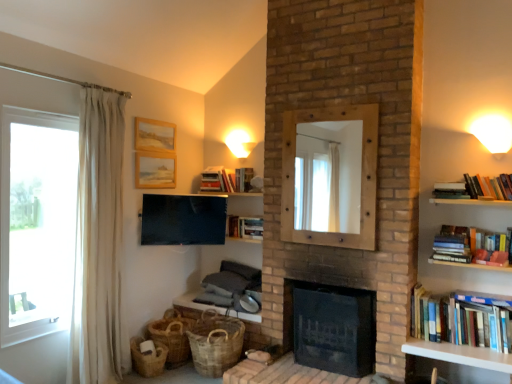
The width and height of the screenshot is (512, 384). What are the coordinates of `wooden mirror at center, arranged as the first fireplace when viewed from the top` in the screenshot? It's located at (361, 177).

In order to click on hardcover books at right, placed as the fourth book when sorted from bottom to top in this screenshot , I will do `click(489, 187)`.

What is the approximate height of matte white sconce at upper center, which ranks as the 2th light fixture in front-to-back order?

9.42 inches.

This screenshot has height=384, width=512. What do you see at coordinates (215, 343) in the screenshot?
I see `brown woven basket at lower left, placed as the 3th basket when sorted from left to right` at bounding box center [215, 343].

At what (x,y) coordinates should I click in order to perform the action: click on wooden mirror at center, the 2th fireplace from the bottom. Please return your answer as a coordinate pair (x, y). Looking at the image, I should click on (361, 177).

Based on the photo, based on their positions, is wooden textured table at lower center, marked as the 1th table in a left-to-right arrangement, located to the left or right of white matte wall sconce at upper right, which ranks as the 1th light fixture in right-to-left order?

wooden textured table at lower center, marked as the 1th table in a left-to-right arrangement, is to the left of white matte wall sconce at upper right, which ranks as the 1th light fixture in right-to-left order.

From the image's perspective, is wooden textured table at lower center, the first table in the back-to-front sequence, on white matte wall sconce at upper right, which ranks as the 1th light fixture in right-to-left order?

No, from the image's perspective, wooden textured table at lower center, the first table in the back-to-front sequence, is not above white matte wall sconce at upper right, which ranks as the 1th light fixture in right-to-left order.

Considering the sizes of wooden textured table at lower center, marked as the 1th table in a left-to-right arrangement, and white matte wall sconce at upper right, which is counted as the 1th light fixture, starting from the front, in the image, is wooden textured table at lower center, marked as the 1th table in a left-to-right arrangement, bigger or smaller than white matte wall sconce at upper right, which is counted as the 1th light fixture, starting from the front,?

Clearly, wooden textured table at lower center, marked as the 1th table in a left-to-right arrangement, is larger in size than white matte wall sconce at upper right, which is counted as the 1th light fixture, starting from the front.

Consider the image. How much distance is there between wooden textured table at lower center, placed as the 2th table when sorted from front to back, and white matte wall sconce at upper right, which is the second light fixture in back-to-front order?

The distance of wooden textured table at lower center, placed as the 2th table when sorted from front to back, from white matte wall sconce at upper right, which is the second light fixture in back-to-front order, is 2.47 meters.

From the image's perspective, between woven brown basket at lower left, which appears as the 2th basket when viewed from the right, and flat screen tv at upper center, who is located below?

woven brown basket at lower left, which appears as the 2th basket when viewed from the right, is shown below in the image.

Consider the image. Can you tell me how much woven brown basket at lower left, which appears as the 2th basket when viewed from the right, and flat screen tv at upper center differ in facing direction?

woven brown basket at lower left, which appears as the 2th basket when viewed from the right, and flat screen tv at upper center are facing 41.9 degrees away from each other.

Is woven brown basket at lower left, which appears as the 2th basket when viewed from the right, not near flat screen tv at upper center?

Actually, woven brown basket at lower left, which appears as the 2th basket when viewed from the right, and flat screen tv at upper center are a little close together.

From a real-world perspective, between woven brown basket at lower left, which appears as the 2th basket when viewed from the right, and flat screen tv at upper center, who is vertically higher?

In real-world perspective, flat screen tv at upper center is above.

Consider the image. Can you confirm if wooden mirror at center, arranged as the first fireplace when viewed from the top, is taller than white sheer curtain at left?

In fact, wooden mirror at center, arranged as the first fireplace when viewed from the top, may be shorter than white sheer curtain at left.

Which of these two, wooden mirror at center, arranged as the first fireplace when viewed from the top, or white sheer curtain at left, is bigger?

white sheer curtain at left.

Can you tell me how much wooden mirror at center, arranged as the first fireplace when viewed from the top, and white sheer curtain at left differ in facing direction?

wooden mirror at center, arranged as the first fireplace when viewed from the top, and white sheer curtain at left are facing 90.1 degrees away from each other.

Is wooden mirror at center, the 2th fireplace from the bottom, beside white sheer curtain at left?

No, wooden mirror at center, the 2th fireplace from the bottom, is not touching white sheer curtain at left.

Is white painted wood shelf at lower right, marked as the first table in a front-to-back arrangement, directly adjacent to woven brown basket at lower left, which appears as the 2th basket when viewed from the right?

There is a gap between white painted wood shelf at lower right, marked as the first table in a front-to-back arrangement, and woven brown basket at lower left, which appears as the 2th basket when viewed from the right.

Between white painted wood shelf at lower right, which is the second table in left-to-right order, and woven brown basket at lower left, which appears as the 2th basket when viewed from the right, which one is positioned in front?

white painted wood shelf at lower right, which is the second table in left-to-right order, is more forward.

Looking at their sizes, would you say white painted wood shelf at lower right, which is the second table in left-to-right order, is wider or thinner than woven brown basket at lower left, the 2th basket from the left?

In the image, white painted wood shelf at lower right, which is the second table in left-to-right order, appears to be wider than woven brown basket at lower left, the 2th basket from the left.

Is white painted wood shelf at lower right, marked as the 2th table in a back-to-front arrangement, facing towards woven brown basket at lower left, which appears as the 2th basket when viewed from the right?

No, white painted wood shelf at lower right, marked as the 2th table in a back-to-front arrangement, is not turned towards woven brown basket at lower left, which appears as the 2th basket when viewed from the right.

Is matte white sconce at upper center, which ranks as the 2th light fixture in front-to-back order, oriented towards brown woven basket at lower left, placed as the 1th basket when sorted from left to right?

No, matte white sconce at upper center, which ranks as the 2th light fixture in front-to-back order, is not turned towards brown woven basket at lower left, placed as the 1th basket when sorted from left to right.

Considering the positions of objects matte white sconce at upper center, which is the second light fixture in right-to-left order, and brown woven basket at lower left, marked as the 3th basket in a right-to-left arrangement, in the image provided, who is more to the left, matte white sconce at upper center, which is the second light fixture in right-to-left order, or brown woven basket at lower left, marked as the 3th basket in a right-to-left arrangement,?

Positioned to the left is brown woven basket at lower left, marked as the 3th basket in a right-to-left arrangement.

Would you say matte white sconce at upper center, which appears as the 1th light fixture when viewed from the back, contains brown woven basket at lower left, marked as the 3th basket in a right-to-left arrangement?

No, brown woven basket at lower left, marked as the 3th basket in a right-to-left arrangement, is located outside of matte white sconce at upper center, which appears as the 1th light fixture when viewed from the back.

Is matte white sconce at upper center, which is the 1th light fixture from left to right, not close to brown woven basket at lower left, which ranks as the first basket in right-to-left order?

matte white sconce at upper center, which is the 1th light fixture from left to right, is positioned a significant distance from brown woven basket at lower left, which ranks as the first basket in right-to-left order.

From a real-world perspective, which is physically above, matte white sconce at upper center, which appears as the 1th light fixture when viewed from the back, or brown woven basket at lower left, placed as the 3th basket when sorted from left to right?

matte white sconce at upper center, which appears as the 1th light fixture when viewed from the back, from a real-world perspective.

Can you confirm if matte white sconce at upper center, which ranks as the 2th light fixture in front-to-back order, is thinner than brown woven basket at lower left, placed as the 3th basket when sorted from left to right?

Yes.

From the image's perspective, is matte white sconce at upper center, which ranks as the 2th light fixture in front-to-back order, located above or below brown woven basket at lower left, placed as the 3th basket when sorted from left to right?

matte white sconce at upper center, which ranks as the 2th light fixture in front-to-back order, is situated higher than brown woven basket at lower left, placed as the 3th basket when sorted from left to right, in the image.

Does hardcover books at right, marked as the second book in a front-to-back arrangement, appear on the right side of matte white sconce at upper center, which is the 1th light fixture from left to right?

Correct, you'll find hardcover books at right, marked as the second book in a front-to-back arrangement, to the right of matte white sconce at upper center, which is the 1th light fixture from left to right.

From the picture: From the image's perspective, which is below, hardcover books at right, the 2th book viewed from the top, or matte white sconce at upper center, which appears as the 1th light fixture when viewed from the back?

hardcover books at right, the 2th book viewed from the top, is shown below in the image.

Could you tell me if hardcover books at right, placed as the fourth book when sorted from bottom to top, is turned towards matte white sconce at upper center, which appears as the 1th light fixture when viewed from the back?

No.

Considering the sizes of objects hardcover books at right, placed as the fourth book when sorted from bottom to top, and matte white sconce at upper center, which appears as the 1th light fixture when viewed from the back, in the image provided, who is wider, hardcover books at right, placed as the fourth book when sorted from bottom to top, or matte white sconce at upper center, which appears as the 1th light fixture when viewed from the back,?

Wider between the two is matte white sconce at upper center, which appears as the 1th light fixture when viewed from the back.

Locate an element on the screen. The width and height of the screenshot is (512, 384). light fixture in front of the wooden textured table at lower center, marked as the 1th table in a left-to-right arrangement is located at coordinates (493, 133).

From the flat screen tv at upper center, count the 1st basket to the left and point to it. Please provide its 2D coordinates.

[(172, 336)]

Estimate the real-world distances between objects in this image. Which object is closer to brown woven basket at lower left, marked as the 3th basket in a right-to-left arrangement, flat screen tv at upper center or hardcover book at upper right, arranged as the 3th book when viewed from the top?

flat screen tv at upper center lies closer to brown woven basket at lower left, marked as the 3th basket in a right-to-left arrangement, than the other object.

Based on their spatial positions, is woven brown basket at lower left, which appears as the 2th basket when viewed from the right, or hardcover books at right, arranged as the fourth book when viewed from the back, further from transparent glass window at left?

hardcover books at right, arranged as the fourth book when viewed from the back.

When comparing their distances from hardcover book at upper right, marked as the third book in a right-to-left arrangement, does wooden picture frame at upper center, acting as the second picture frame starting from the top, or dark brick fireplace at center, placed as the 1th fireplace when sorted from bottom to top, seem further?

Based on the image, wooden picture frame at upper center, acting as the second picture frame starting from the top, appears to be further to hardcover book at upper right, marked as the third book in a right-to-left arrangement.

Which object lies nearer to the anchor point brown woven basket at lower left, placed as the 1th basket when sorted from left to right, hardcover book at upper center, positioned as the 4th book in front-to-back order, or hardcover books at upper center, which is counted as the 1th book, starting from the top?

hardcover book at upper center, positioned as the 4th book in front-to-back order, is closer to brown woven basket at lower left, placed as the 1th basket when sorted from left to right.

Which object lies nearer to the anchor point hardcover books at right, placed as the fourth book when sorted from bottom to top, wooden mirror at center, arranged as the first fireplace when viewed from the top, or wooden textured table at lower center, placed as the 2th table when sorted from front to back?

The object closer to hardcover books at right, placed as the fourth book when sorted from bottom to top, is wooden mirror at center, arranged as the first fireplace when viewed from the top.

From the image, which object appears to be farther from wooden picture frame at upper center, which is the first picture frame from top to bottom, woven brown basket at lower left, the 2th basket from the left, or brown woven basket at lower left, placed as the 3th basket when sorted from left to right?

The object further to wooden picture frame at upper center, which is the first picture frame from top to bottom, is brown woven basket at lower left, placed as the 3th basket when sorted from left to right.

Estimate the real-world distances between objects in this image. Which object is closer to white matte wall sconce at upper right, which is the second light fixture in back-to-front order, wooden picture frame at upper center, which is the first picture frame from top to bottom, or hardcover books at upper center, which is the fifth book from bottom to top?

hardcover books at upper center, which is the fifth book from bottom to top, lies closer to white matte wall sconce at upper right, which is the second light fixture in back-to-front order, than the other object.

Based on their spatial positions, is brown woven basket at lower left, which ranks as the first basket in right-to-left order, or hardcover books at upper center, which is counted as the 1th book, starting from the top, further from wooden textured table at lower center, acting as the 2th table starting from the right?

hardcover books at upper center, which is counted as the 1th book, starting from the top, lies further to wooden textured table at lower center, acting as the 2th table starting from the right, than the other object.

Image resolution: width=512 pixels, height=384 pixels. What are the coordinates of `window between wooden picture frame at upper center, the second picture frame ordered from the bottom, and wooden textured table at lower center, the first table in the back-to-front sequence, from top to bottom` in the screenshot? It's located at (37, 222).

This screenshot has width=512, height=384. I want to click on television located between woven brown basket at lower left, the 2th basket from the left, and white matte wall sconce at upper right, placed as the 2th light fixture when sorted from left to right, in the left-right direction, so click(x=183, y=220).

Image resolution: width=512 pixels, height=384 pixels. In order to click on table between dark brick fireplace at center, placed as the 1th fireplace when sorted from bottom to top, and hardcover books at right, which ranks as the second book in right-to-left order, from left to right in this screenshot , I will do `click(460, 354)`.

Find the location of a particular element. curtain located between transparent glass window at left and white painted wood shelf at lower right, marked as the first table in a front-to-back arrangement, in the left-right direction is located at coordinates (98, 240).